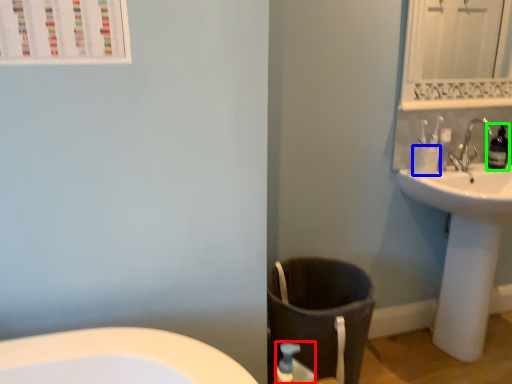
Question: Which is farther away from soap dispenser (highlighted by a red box)? toilet paper (highlighted by a blue box) or bottle (highlighted by a green box)?

Choices:
 (A) toilet paper
 (B) bottle

Answer: (B)